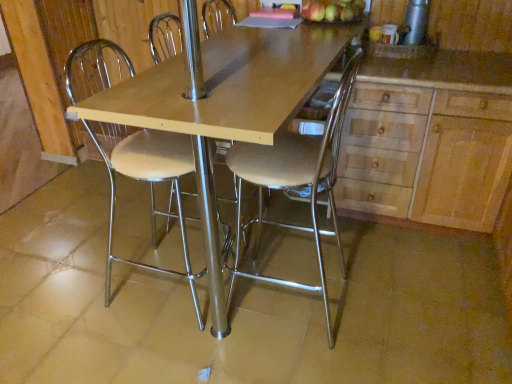
Where is `blank area to the left of metallic silver stool at center, the first chair in the left-to-right sequence`? blank area to the left of metallic silver stool at center, the first chair in the left-to-right sequence is located at coordinates (86, 288).